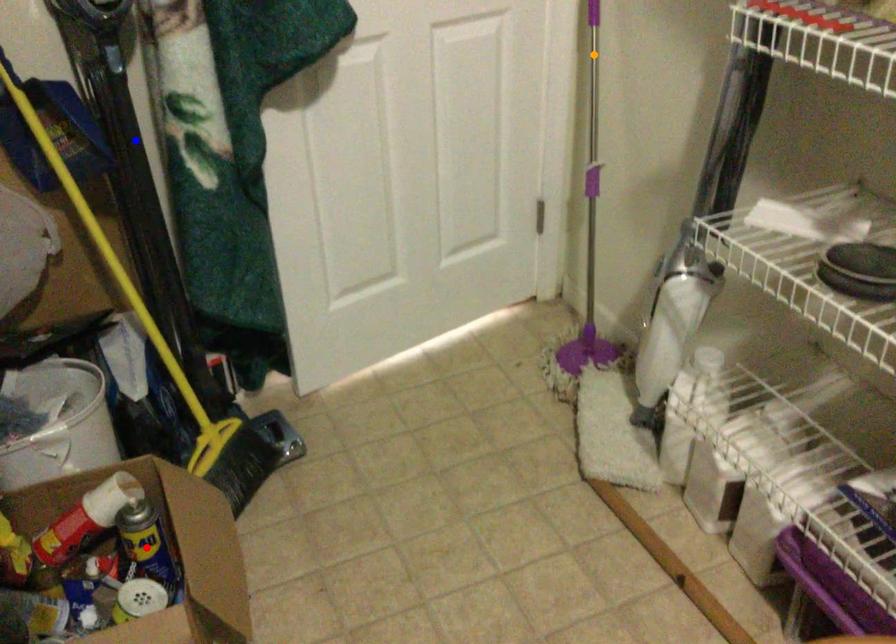
Order these from nearest to farthest:
orange point
blue point
red point

red point → blue point → orange point